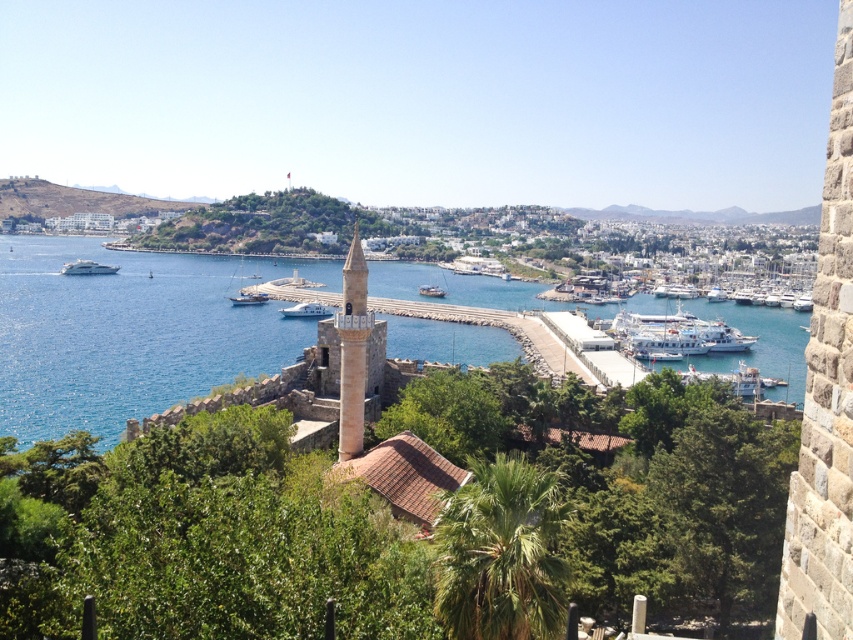
Is white glossy boat at center-right closer to the viewer compared to dark blue wooden boat at center?

Yes, it is.

Which is behind, point (746, 348) or point (263, 298)?

The point (263, 298) is more distant.

The width and height of the screenshot is (853, 640). Find the location of `white glossy boat at center-right`. white glossy boat at center-right is located at coordinates (677, 333).

Is blue water at center smaller than dark blue wooden boat at center?

Incorrect, blue water at center is not smaller in size than dark blue wooden boat at center.

Between blue water at center and dark blue wooden boat at center, which one appears on the right side from the viewer's perspective?

From the viewer's perspective, dark blue wooden boat at center appears more on the right side.

Who is more distant from viewer, (22,339) or (242,298)?

Point (242,298)

This screenshot has width=853, height=640. Identify the location of blue water at center. (122, 336).

Is light brown stone tower at center below dark blue wooden boat at center?

Yes, light brown stone tower at center is below dark blue wooden boat at center.

At what (x,y) coordinates should I click in order to perform the action: click on light brown stone tower at center. Please return your answer as a coordinate pair (x, y). The image size is (853, 640). Looking at the image, I should click on (352, 349).